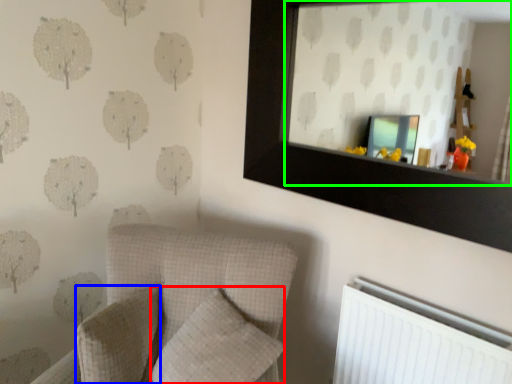
Question: Which object is the farthest from pillow (highlighted by a red box)? Choose among these: pillow (highlighted by a blue box) or mirror (highlighted by a green box).

Choices:
 (A) pillow
 (B) mirror

Answer: (B)